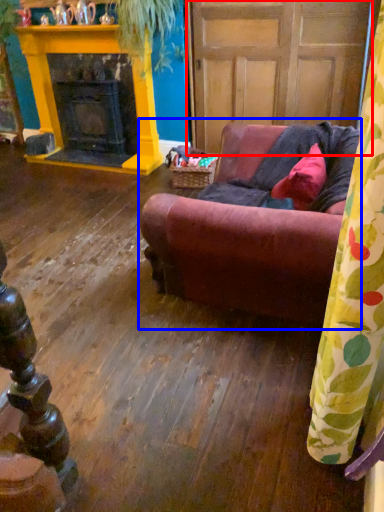
Question: Among these objects, which one is farthest to the camera, door (highlighted by a red box) or studio couch (highlighted by a blue box)?

Choices:
 (A) door
 (B) studio couch

Answer: (A)